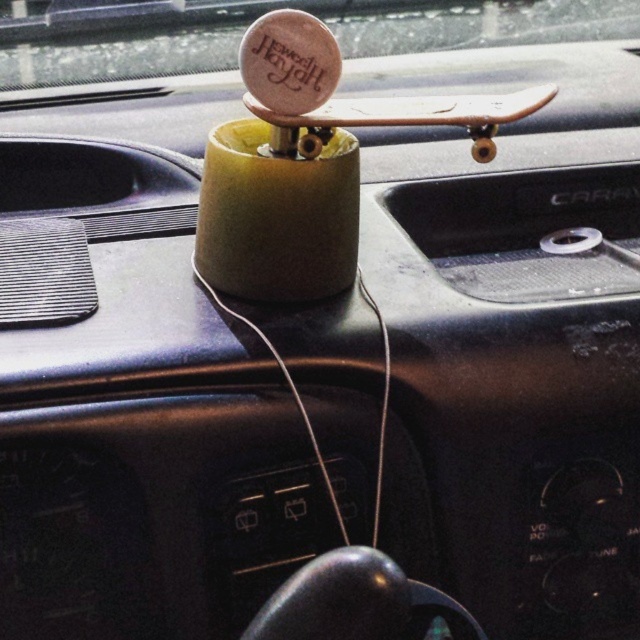
You are sitting in the driver seat of the car. You need to place a small keychain exactly where the wooden circle at upper center is located. Where on the dashboard should you place the keychain?

Place the keychain at the coordinates 0.022 on the x axis and 0.408 on the y axis, which corresponds to the location of the wooden circle at upper center.

You are sitting in the driver seat of the car shown in the image. There is a point located at coordinates point (56, 42). Can you reach this point with your right hand without moving your seat?

The point (56, 42) is 3.81 feet away from the viewer. Since the average arm length is about 2.5 feet, you cannot reach it with your right hand without moving your seat.

You are sitting in the driver seat of the car and want to reach the wooden skateboard at center. Is the wooden circle at upper center blocking your direct path to it?

The wooden skateboard at center is behind the wooden circle at upper center, so the wooden circle at upper center is blocking your direct path to it.